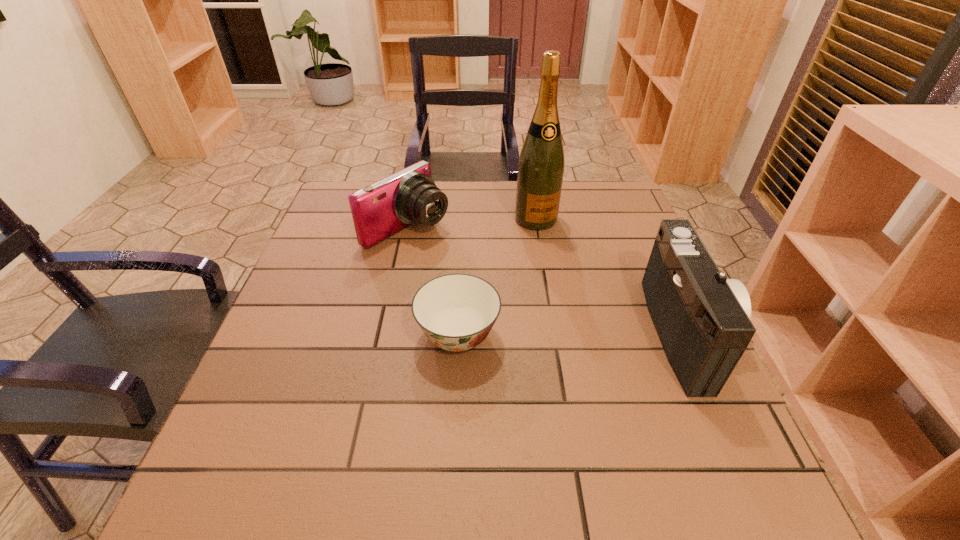
In the image, there is a desktop. Identify the location of blank space at the left edge. (287, 347).

In the image, there is a desktop. Identify the location of vacant space at the right edge. This screenshot has height=540, width=960. (629, 309).

The width and height of the screenshot is (960, 540). I want to click on vacant position at the far left corner of the desktop, so click(x=326, y=207).

In the image, there is a desktop. Where is `blank space at the far right corner`? blank space at the far right corner is located at coordinates (588, 216).

Locate an element on the screen. The height and width of the screenshot is (540, 960). vacant space at the near right corner of the desktop is located at coordinates (706, 418).

You are a GUI agent. You are given a task and a screenshot of the screen. Output one action in this format:
    pyautogui.click(x=<x>, y=<y>)
    Task: Click on the empty space that is in between the second object from right to left and the camcorder
    The height and width of the screenshot is (540, 960).
    Given the screenshot: What is the action you would take?
    pyautogui.click(x=612, y=276)

The image size is (960, 540). Identify the location of free space between the third tallest object and the third shortest object. (547, 281).

At what (x,y) coordinates should I click in order to perform the action: click on vacant point located between the rightmost object and the wine bottle. Please return your answer as a coordinate pair (x, y). The image size is (960, 540). Looking at the image, I should click on (612, 276).

I want to click on empty space that is in between the camcorder and the wine bottle, so click(612, 276).

Identify the location of vacant point located between the second object from right to left and the soup bowl. (497, 278).